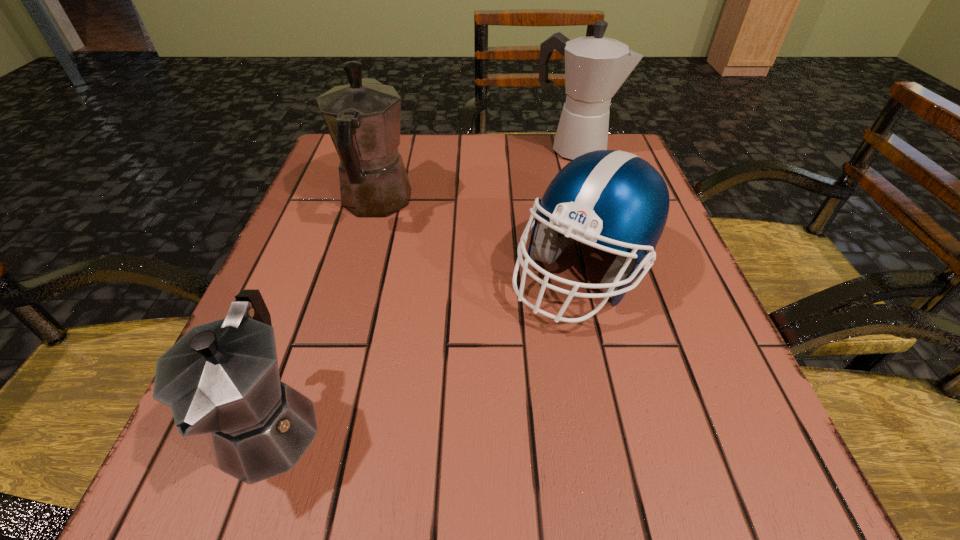
Where is `vacant area at the near right corner`? vacant area at the near right corner is located at coordinates (676, 483).

This screenshot has width=960, height=540. In order to click on vacant space that is in between the football helmet and the second nearest coffeepot in this screenshot , I will do `click(479, 238)`.

At what (x,y) coordinates should I click in order to perform the action: click on free point between the rightmost coffeepot and the second farthest coffeepot. Please return your answer as a coordinate pair (x, y). Looking at the image, I should click on (475, 176).

Find the location of a particular element. The height and width of the screenshot is (540, 960). free space between the second farthest coffeepot and the football helmet is located at coordinates pyautogui.click(x=479, y=238).

The width and height of the screenshot is (960, 540). Find the location of `free space between the rightmost coffeepot and the second farthest coffeepot`. free space between the rightmost coffeepot and the second farthest coffeepot is located at coordinates (475, 176).

Where is `vacant point located between the football helmet and the second nearest coffeepot`? Image resolution: width=960 pixels, height=540 pixels. vacant point located between the football helmet and the second nearest coffeepot is located at coordinates (479, 238).

The height and width of the screenshot is (540, 960). What are the coordinates of `vacant area that lies between the shortest coffeepot and the farthest coffeepot` in the screenshot? It's located at (422, 288).

Where is `vacant region between the football helmet and the nearest coffeepot`? Image resolution: width=960 pixels, height=540 pixels. vacant region between the football helmet and the nearest coffeepot is located at coordinates (426, 349).

Identify which object is the second nearest to the farthest object. Please provide its 2D coordinates. Your answer should be formatted as a tuple, i.e. [(x, y)], where the tuple contains the x and y coordinates of a point satisfying the conditions above.

[(363, 118)]

This screenshot has width=960, height=540. What are the coordinates of `object that stands as the second closest to the farthest coffeepot` in the screenshot? It's located at (363, 118).